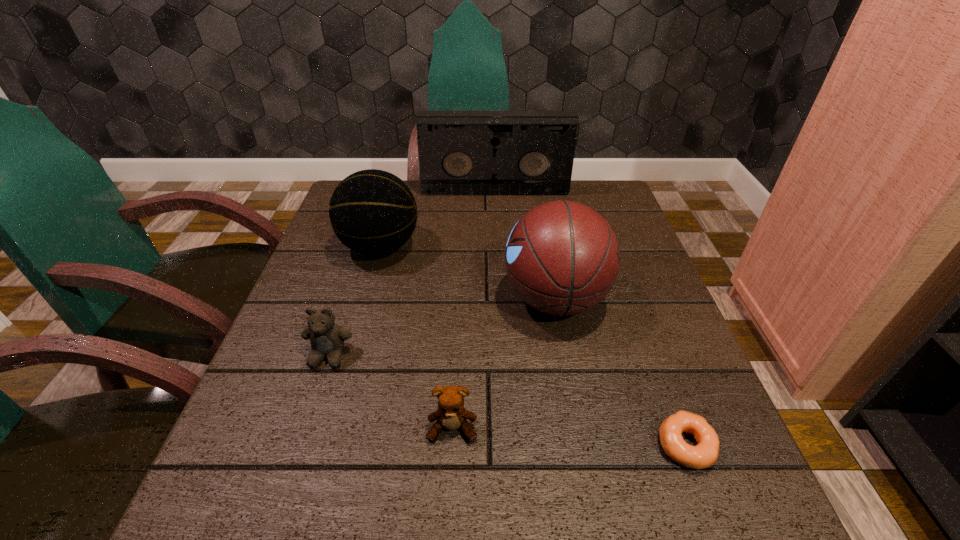
Image resolution: width=960 pixels, height=540 pixels. Identify the location of vacant area that lies between the doughnut and the fifth tallest object. (569, 437).

Locate an element on the screen. The height and width of the screenshot is (540, 960). vacant area between the shortest object and the left basketball is located at coordinates (533, 346).

Identify the location of blank region between the rightmost object and the right basketball. (620, 372).

Image resolution: width=960 pixels, height=540 pixels. What are the coordinates of `free spot between the farthest object and the left basketball` in the screenshot? It's located at (438, 219).

Identify the location of free space that is in between the farthest object and the rightmost object. (590, 319).

I want to click on free space between the fourth farthest object and the shortest object, so click(508, 400).

Image resolution: width=960 pixels, height=540 pixels. I want to click on free space between the rightmost object and the right basketball, so click(620, 372).

At what (x,y) coordinates should I click in order to perform the action: click on free area in between the left basketball and the right teddy bear. Please return your answer as a coordinate pair (x, y). The image size is (960, 540). Looking at the image, I should click on (417, 338).

This screenshot has width=960, height=540. I want to click on object that ranks as the fourth closest to the left basketball, so click(451, 414).

Locate which object is the third closest to the doughnut. Please provide its 2D coordinates. Your answer should be formatted as a tuple, i.e. [(x, y)], where the tuple contains the x and y coordinates of a point satisfying the conditions above.

[(327, 338)]